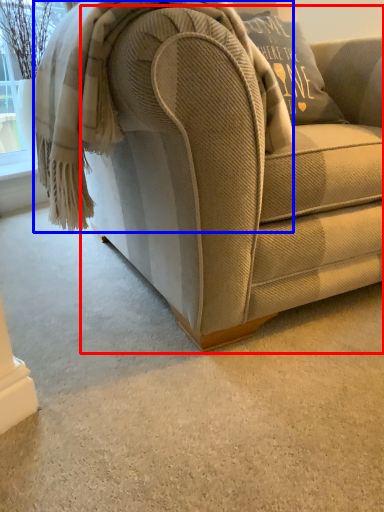
Question: Which object is further to the camera taking this photo, studio couch (highlighted by a red box) or blanket (highlighted by a blue box)?

Choices:
 (A) studio couch
 (B) blanket

Answer: (B)